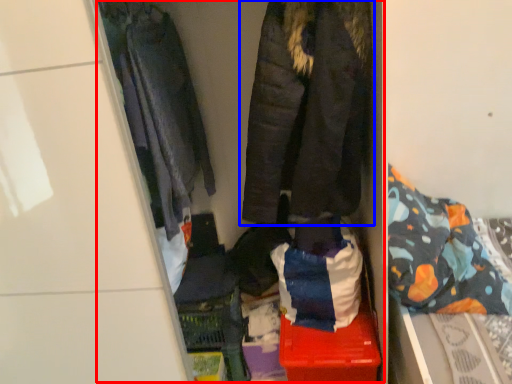
Question: Which object is further to the camera taking this photo, closet (highlighted by a red box) or jacket (highlighted by a blue box)?

Choices:
 (A) closet
 (B) jacket

Answer: (B)